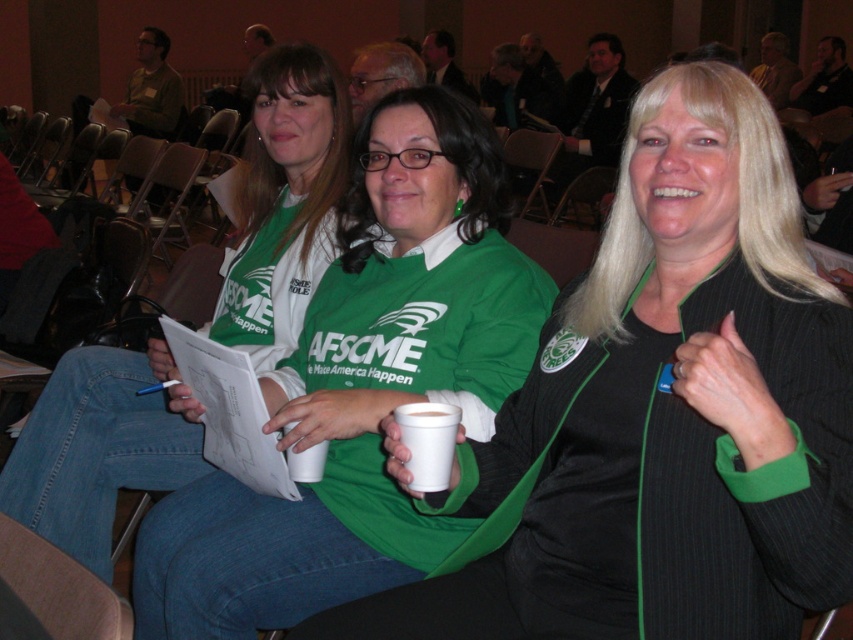
Between point (213, 618) and point (252, 170), which one is positioned behind?

Positioned behind is point (252, 170).

Is point (184, 541) closer to viewer compared to point (277, 305)?

That is True.

Identify the location of green matte shirt at center. The width and height of the screenshot is (853, 640). (363, 387).

Identify the location of green matte shirt at center. This screenshot has height=640, width=853. (363, 387).

Between green matte shirt at center and white styrofoam cup at center, which one has more height?

green matte shirt at center

Is green matte shirt at center to the left of white styrofoam cup at center from the viewer's perspective?

Correct, you'll find green matte shirt at center to the left of white styrofoam cup at center.

The image size is (853, 640). Find the location of `green matte shirt at center`. green matte shirt at center is located at coordinates (363, 387).

Is point (126, 413) less distant than point (453, 429)?

No, (126, 413) is further to viewer.

Does matte green t-shirt at center come in front of white styrofoam cup at center?

No, it is not.

Locate an element on the screen. The width and height of the screenshot is (853, 640). matte green t-shirt at center is located at coordinates (285, 202).

I want to click on matte green t-shirt at center, so click(x=285, y=202).